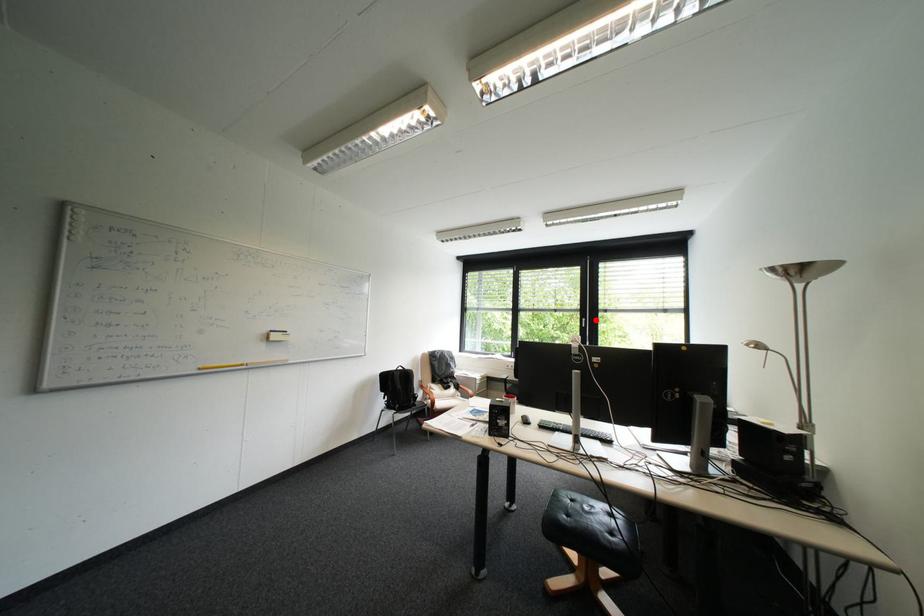
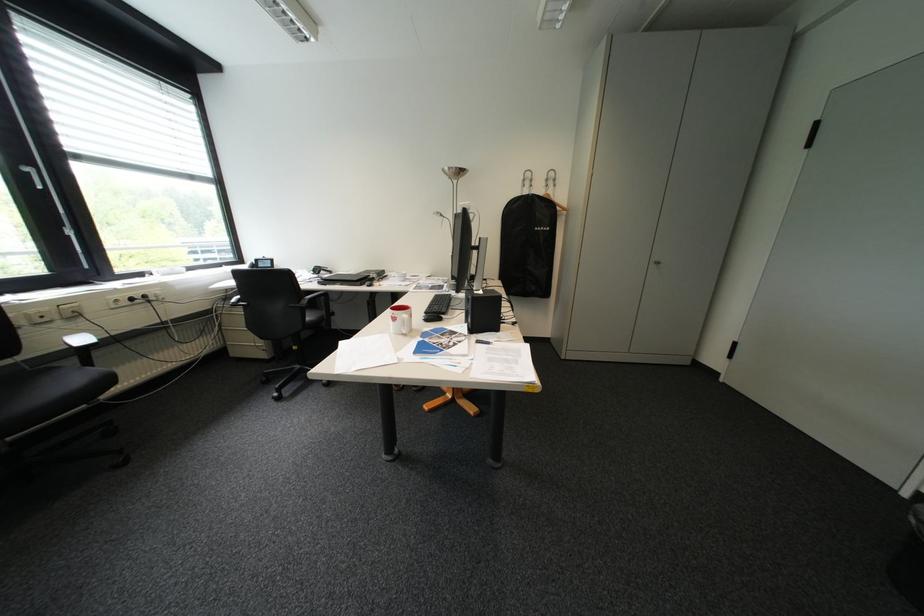
Question: I am providing you with two images of the same scene from different viewpoints. In image1, a red point is highlighted. Considering the same 3D point in image2, which of the following is correct?

Choices:
 (A) It is closer
 (B) It is farther

Answer: (B)